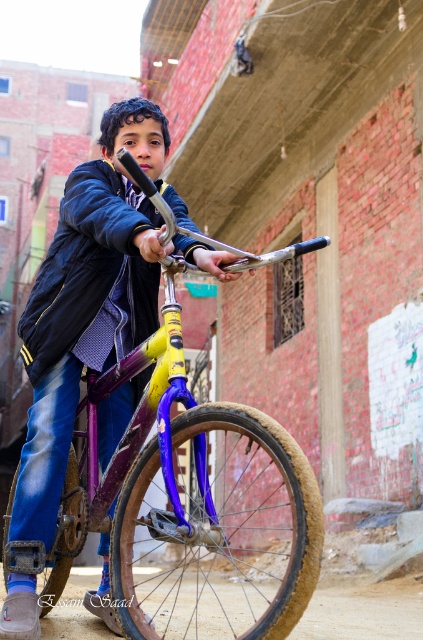
Question: Can you confirm if yellow matte bicycle at center is smaller than navy blue fabric jacket at center?

Choices:
 (A) no
 (B) yes

Answer: (A)

Question: Which point appears closest to the camera in this image?

Choices:
 (A) (129, 205)
 (B) (104, 554)

Answer: (A)

Question: Can you confirm if yellow matte bicycle at center is positioned to the right of navy blue fabric jacket at center?

Choices:
 (A) yes
 (B) no

Answer: (A)

Question: Can you confirm if yellow matte bicycle at center is positioned to the left of navy blue fabric jacket at center?

Choices:
 (A) yes
 (B) no

Answer: (B)